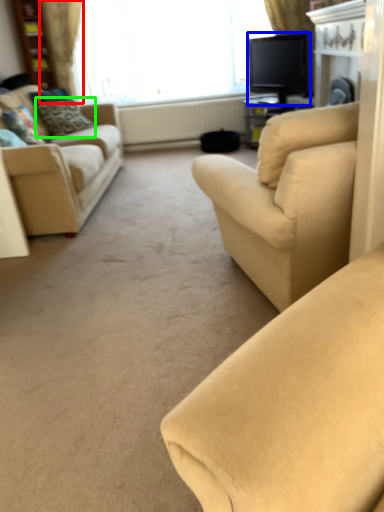
Question: Which is farther away from curtain (highlighted by a red box)? television (highlighted by a blue box) or pillow (highlighted by a green box)?

Choices:
 (A) television
 (B) pillow

Answer: (A)